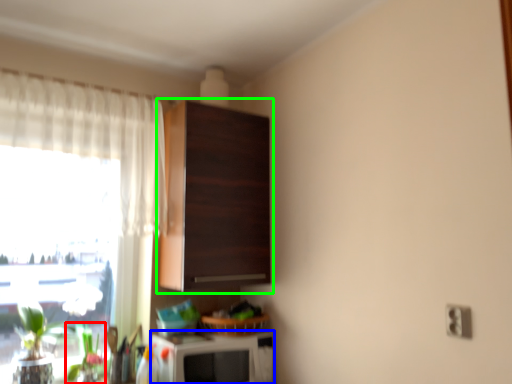
Question: Which object is positioned closest to plant (highlighted by a red box)? Select from appliance (highlighted by a blue box) and cabinetry (highlighted by a green box).

Choices:
 (A) appliance
 (B) cabinetry

Answer: (A)